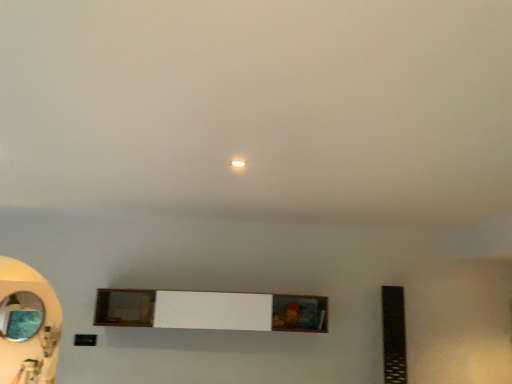
You are a GUI agent. You are given a task and a screenshot of the screen. Output one action in this format:
    pyautogui.click(x=<x>, y=<y>)
    Task: Click on the oval glass mirror at left
    Image resolution: width=512 pixels, height=384 pixels.
    Given the screenshot: What is the action you would take?
    pyautogui.click(x=21, y=316)

What do you see at coordinates (21, 316) in the screenshot? This screenshot has height=384, width=512. I see `oval glass mirror at left` at bounding box center [21, 316].

Locate an element on the screen. The width and height of the screenshot is (512, 384). white wood shelf at center is located at coordinates (211, 310).

The width and height of the screenshot is (512, 384). What do you see at coordinates (211, 310) in the screenshot?
I see `white wood shelf at center` at bounding box center [211, 310].

Identify the location of oval glass mirror at left. (21, 316).

Which is more to the left, white wood shelf at center or oval glass mirror at left?

From the viewer's perspective, oval glass mirror at left appears more on the left side.

Which object is closer to the camera taking this photo, white wood shelf at center or oval glass mirror at left?

white wood shelf at center is in front.

Which is farther, (110, 314) or (14, 341)?

The point (110, 314) is behind.

From the image's perspective, is white wood shelf at center on top of oval glass mirror at left?

A: Yes, from the image's perspective, white wood shelf at center is over oval glass mirror at left.

From a real-world perspective, relative to oval glass mirror at left, is white wood shelf at center vertically above or below?

In terms of real-world spatial position, white wood shelf at center is above oval glass mirror at left.

Considering the sizes of objects white wood shelf at center and oval glass mirror at left in the image provided, who is thinner, white wood shelf at center or oval glass mirror at left?

With smaller width is oval glass mirror at left.

Between white wood shelf at center and oval glass mirror at left, which one has less height?

white wood shelf at center is shorter.

Does white wood shelf at center have a larger size compared to oval glass mirror at left?

Yes.

Is white wood shelf at center spatially inside oval glass mirror at left, or outside of it?

white wood shelf at center is spatially situated outside oval glass mirror at left.

Is there a large distance between white wood shelf at center and oval glass mirror at left?

No, white wood shelf at center is not far from oval glass mirror at left.

Is white wood shelf at center facing away from oval glass mirror at left?

No.

What's the angular difference between white wood shelf at center and oval glass mirror at left's facing directions?

The facing directions of white wood shelf at center and oval glass mirror at left are 0.865 degrees apart.

Where is `mirror directly beneath the white wood shelf at center (from a real-world perspective)`? This screenshot has height=384, width=512. mirror directly beneath the white wood shelf at center (from a real-world perspective) is located at coordinates (21, 316).

Can you confirm if oval glass mirror at left is positioned to the right of white wood shelf at center?

Incorrect, oval glass mirror at left is not on the right side of white wood shelf at center.

Considering the positions of objects oval glass mirror at left and white wood shelf at center in the image provided, who is behind, oval glass mirror at left or white wood shelf at center?

oval glass mirror at left is more distant.

Is point (24, 311) less distant than point (120, 297)?

Yes, it is in front of point (120, 297).

From the image's perspective, would you say oval glass mirror at left is shown under white wood shelf at center?

Yes.

Looking at this image, from a real-world perspective, is oval glass mirror at left below white wood shelf at center?

Yes, from a real-world perspective, oval glass mirror at left is below white wood shelf at center.

Which of these two, oval glass mirror at left or white wood shelf at center, is thinner?

oval glass mirror at left is thinner.

Considering the sizes of oval glass mirror at left and white wood shelf at center in the image, is oval glass mirror at left taller or shorter than white wood shelf at center?

Considering their sizes, oval glass mirror at left has more height than white wood shelf at center.

Can you confirm if oval glass mirror at left is smaller than white wood shelf at center?

Yes, oval glass mirror at left is smaller than white wood shelf at center.

In the scene shown: Can we say oval glass mirror at left lies outside white wood shelf at center?

Yes, oval glass mirror at left is located beyond the bounds of white wood shelf at center.

Is oval glass mirror at left not close to white wood shelf at center?

No, there isn't a large distance between oval glass mirror at left and white wood shelf at center.

Consider the image. Is oval glass mirror at left turned away from white wood shelf at center?

oval glass mirror at left is not turned away from white wood shelf at center.

The image size is (512, 384). Find the location of `shelf that is above the oval glass mirror at left (from the image's perspective)`. shelf that is above the oval glass mirror at left (from the image's perspective) is located at coordinates (211, 310).

In order to click on mirror behind the white wood shelf at center in this screenshot , I will do `click(21, 316)`.

Locate an element on the screen. The width and height of the screenshot is (512, 384). shelf above the oval glass mirror at left (from the image's perspective) is located at coordinates (211, 310).